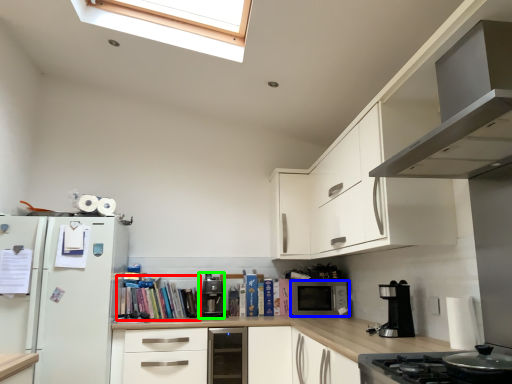
Question: Which object is positioned farthest from book (highlighted by a red box)? Select from microwave oven (highlighted by a blue box) and coffee machine (highlighted by a green box).

Choices:
 (A) microwave oven
 (B) coffee machine

Answer: (A)